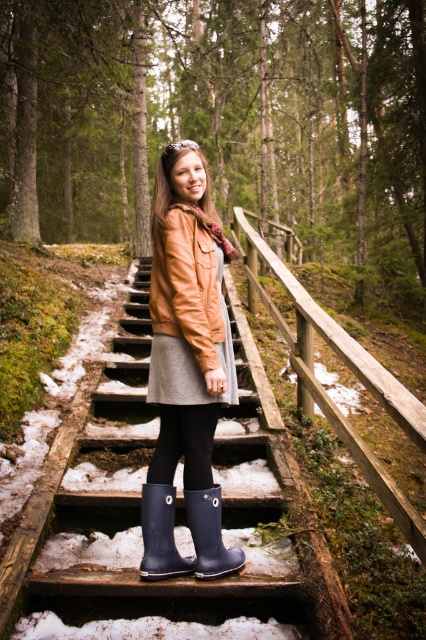
What are the coordinates of `wooden stairs at center` in the screenshot? It's located at (141, 529).

Who is more distant from viewer, (221, 628) or (221, 538)?

Point (221, 538)

Image resolution: width=426 pixels, height=640 pixels. In order to click on wooden stairs at center in this screenshot , I will do `click(141, 529)`.

Is the position of wooden stairs at center less distant than that of leather jacket at center?

That is True.

Does point (226, 474) lie behind point (170, 285)?

Yes.

Does point (54, 554) come behind point (203, 305)?

Yes.

Where is `wooden stairs at center`? wooden stairs at center is located at coordinates (141, 529).

Which is behind, point (230, 433) or point (340, 412)?

Positioned behind is point (230, 433).

What do you see at coordinates (141, 529) in the screenshot? I see `wooden stairs at center` at bounding box center [141, 529].

Which is in front, point (245, 573) or point (359, 456)?

Point (359, 456) is in front.

At what (x,y) coordinates should I click in order to perform the action: click on wooden stairs at center. Please return your answer as a coordinate pair (x, y). Image resolution: width=426 pixels, height=640 pixels. Looking at the image, I should click on (141, 529).